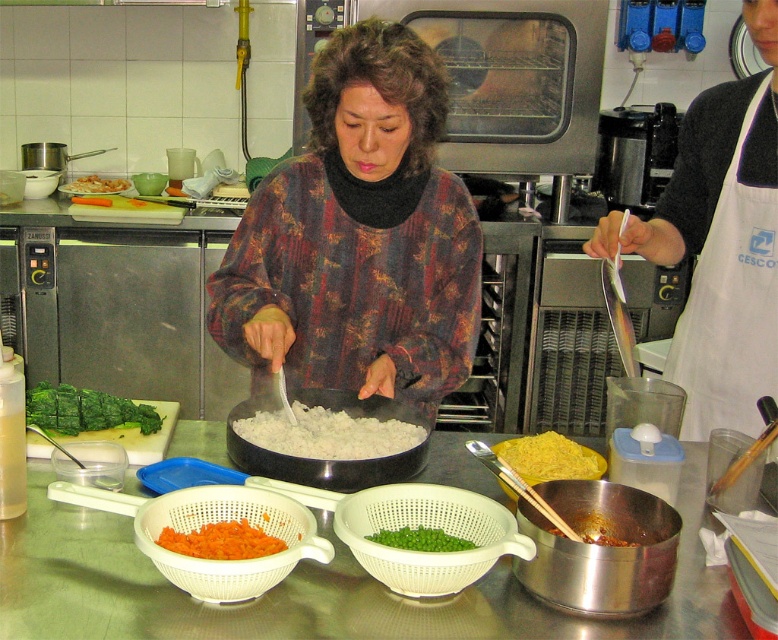
You are a chef in the kitchen. You need to place the green leafy vegetable at center on the countertop. Where exactly should you place it?

The green leafy vegetable at center should be placed at the coordinates point (83, 410).

You are standing at the point marked by the coordinates point (156, 500) in the kitchen. You need to hand a 1.2 meter long rolling pin to someone across the kitchen. Can you reach them without moving from your current position?

The distance between you and the viewer is 1.08 meters, which is shorter than the rolling pin length of 1.2 meters. Therefore, you can reach them by extending the rolling pin.

You are a chef in a busy kitchen and need to choose a container to hold a large quantity of vegetables. Which object from the scene would be more suitable between the white plastic colander at center and the clear plastic container at center?

The white plastic colander at center has a greater width than the clear plastic container at center, making it more suitable for holding a large quantity of vegetables due to its wider base.